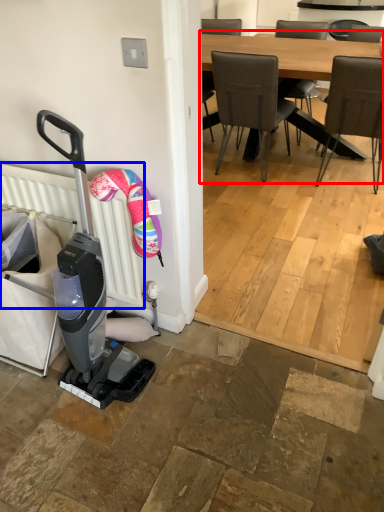
Question: Which object is further to the camera taking this photo, kitchen & dining room table (highlighted by a red box) or radiator (highlighted by a blue box)?

Choices:
 (A) kitchen & dining room table
 (B) radiator

Answer: (A)